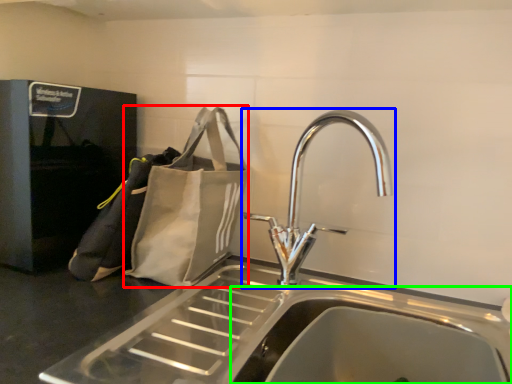
Question: Considering the real-world distances, which object is closest to pouch (highlighted by a red box)? tap (highlighted by a blue box) or sink (highlighted by a green box).

Choices:
 (A) tap
 (B) sink

Answer: (A)